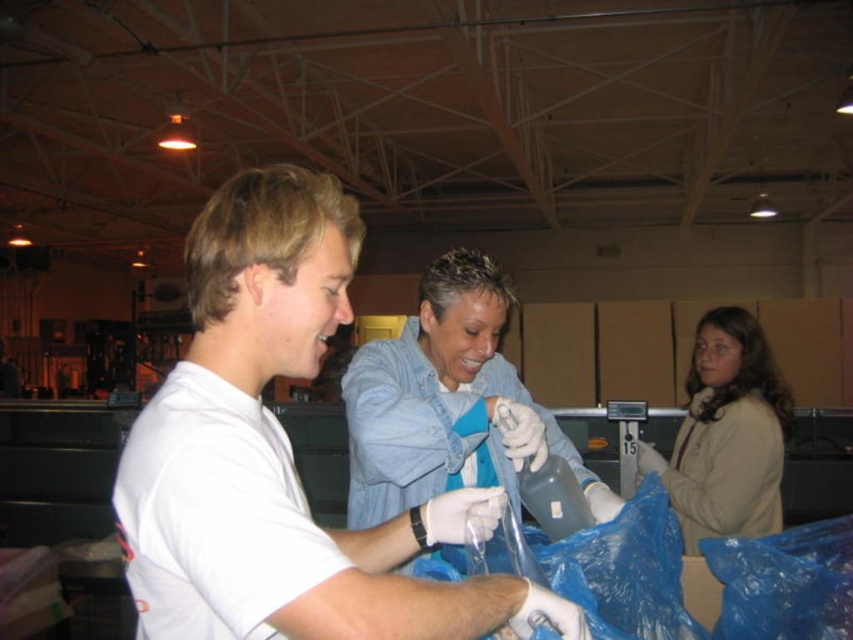
Which of these two, white matte shirt at center or beige fleece jacket at right, stands shorter?

Standing shorter between the two is white matte shirt at center.

This screenshot has width=853, height=640. Describe the element at coordinates (281, 454) in the screenshot. I see `white matte shirt at center` at that location.

Is point (311, 250) in front of point (747, 397)?

Yes.

Find the location of a particular element. Image resolution: width=853 pixels, height=640 pixels. white matte shirt at center is located at coordinates [x=281, y=454].

Between white matte gloves at center and beige fleece jacket at right, which one has less height?

With less height is white matte gloves at center.

Can you confirm if white matte gloves at center is wider than beige fleece jacket at right?

Yes.

Which is behind, point (524, 440) or point (735, 378)?

The point (735, 378) is behind.

Locate an element on the screen. This screenshot has width=853, height=640. white matte gloves at center is located at coordinates (448, 403).

Is point (311, 243) farther from camera compared to point (490, 282)?

No, it is not.

Can you confirm if white matte shirt at center is positioned above white matte gloves at center?

Correct, white matte shirt at center is located above white matte gloves at center.

Is point (218, 588) positioned before point (358, 352)?

That is True.

Find the location of a particular element. white matte shirt at center is located at coordinates (281, 454).